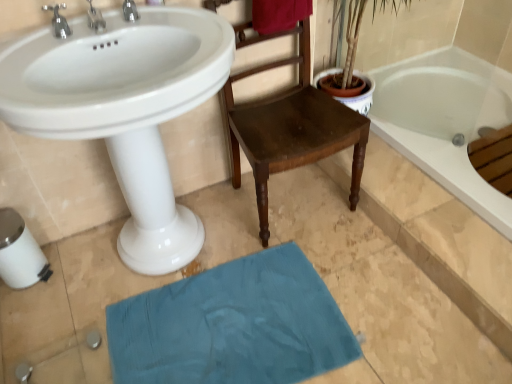
Where is `free point to the left of silver metallic tap at upper left, which ranks as the first tap in right-to-left order`? This screenshot has height=384, width=512. free point to the left of silver metallic tap at upper left, which ranks as the first tap in right-to-left order is located at coordinates (78, 36).